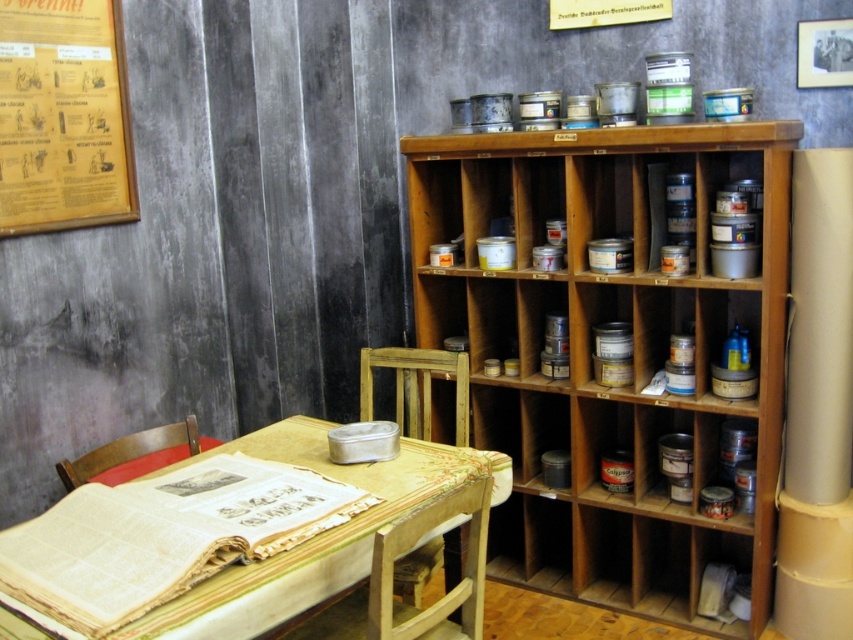
Who is taller, wooden framed poster at upper left or wooden table at center?

Standing taller between the two is wooden framed poster at upper left.

Who is positioned more to the left, wooden framed poster at upper left or wooden table at center?

From the viewer's perspective, wooden framed poster at upper left appears more on the left side.

Is point (71, 65) less distant than point (473, 456)?

No, it is not.

Locate an element on the screen. This screenshot has height=640, width=853. wooden framed poster at upper left is located at coordinates (62, 116).

Does wooden shelves at center have a larger size compared to wooden table at center?

Yes.

Consider the image. Which of these two, wooden shelves at center or wooden table at center, stands shorter?

Standing shorter between the two is wooden table at center.

Between point (531, 406) and point (498, 493), which one is positioned in front?

Positioned in front is point (498, 493).

Locate an element on the screen. wooden shelves at center is located at coordinates pyautogui.click(x=590, y=349).

Who is shorter, wooden shelves at center or wooden framed poster at upper left?

wooden framed poster at upper left

Can you confirm if wooden shelves at center is bigger than wooden framed poster at upper left?

Yes, wooden shelves at center is bigger than wooden framed poster at upper left.

Which is in front, point (579, 561) or point (19, 221)?

Point (19, 221)

This screenshot has width=853, height=640. Identify the location of wooden shelves at center. (590, 349).